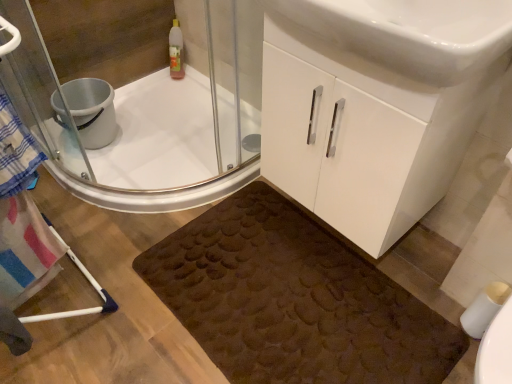
Locate an element on the screen. This screenshot has width=512, height=384. free point above brown textured bath mat at lower center (from a real-world perspective) is located at coordinates (283, 291).